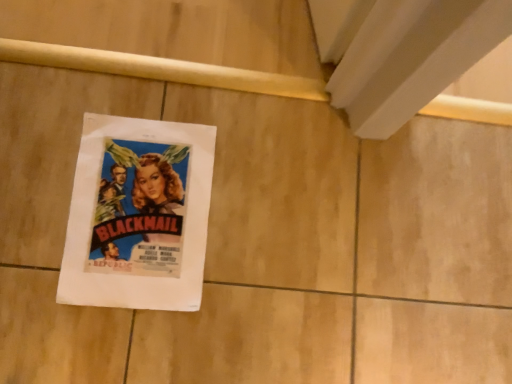
This screenshot has width=512, height=384. What do you see at coordinates (138, 215) in the screenshot?
I see `matte paper poster at lower left` at bounding box center [138, 215].

In order to click on matte paper poster at lower left in this screenshot , I will do `click(138, 215)`.

Where is `matte paper poster at lower left`? matte paper poster at lower left is located at coordinates (138, 215).